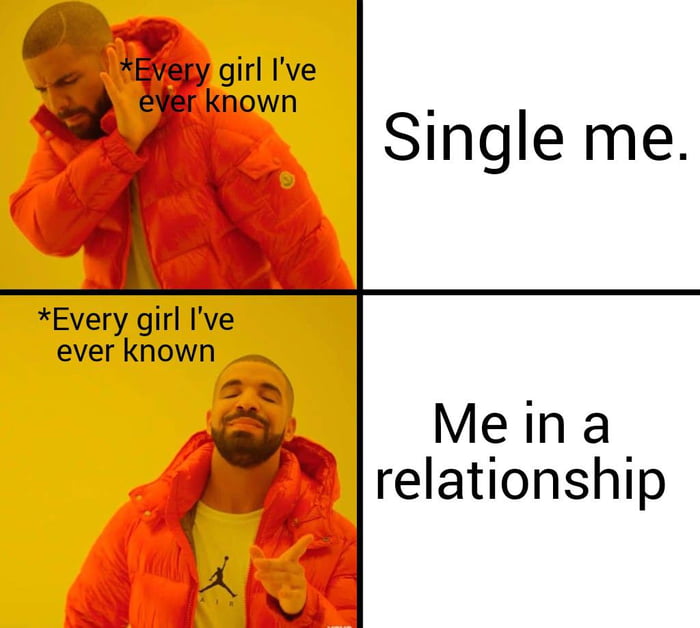
Find the location of `coat`. coat is located at coordinates (192, 187), (288, 497).